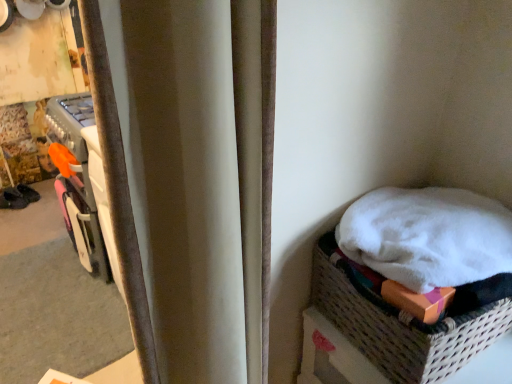
Locate an element on the screen. The width and height of the screenshot is (512, 384). dark brown leather shoe at left is located at coordinates (13, 199).

Does white woven basket at lower right lie behind velvet curtain at center?

Yes, the depth of white woven basket at lower right is greater than that of velvet curtain at center.

From a real-world perspective, between white woven basket at lower right and velvet curtain at center, who is vertically lower?

In real-world perspective, white woven basket at lower right is lower.

From the image's perspective, is white woven basket at lower right beneath velvet curtain at center?

Yes, from the image's perspective, white woven basket at lower right is beneath velvet curtain at center.

Is white woven basket at lower right situated inside velvet curtain at center or outside?

white woven basket at lower right exists outside the volume of velvet curtain at center.

Does velvet curtain at center have a larger size compared to dark brown leather shoe at left?

Correct, velvet curtain at center is larger in size than dark brown leather shoe at left.

Considering the sizes of objects velvet curtain at center and dark brown leather shoe at left in the image provided, who is taller, velvet curtain at center or dark brown leather shoe at left?

velvet curtain at center is taller.

From the image's perspective, relative to dark brown leather shoe at left, is velvet curtain at center above or below?

Based on their image positions, velvet curtain at center is located beneath dark brown leather shoe at left.

Looking at their sizes, would you say velvet curtain at center is wider or thinner than dark brown leather shoe at left?

Clearly, velvet curtain at center has more width compared to dark brown leather shoe at left.

Between dark brown leather shoe at left and white woven basket at lower right, which one has smaller size?

Smaller between the two is dark brown leather shoe at left.

Are dark brown leather shoe at left and white woven basket at lower right making contact?

No, dark brown leather shoe at left is not in contact with white woven basket at lower right.

Find the location of a particular element. footwear below the white woven basket at lower right (from a real-world perspective) is located at coordinates (13, 199).

From the image's perspective, does dark brown leather shoe at left appear higher than white woven basket at lower right?

Yes, from the image's perspective, dark brown leather shoe at left is over white woven basket at lower right.

Is velvet curtain at center bigger than white woven basket at lower right?

Correct, velvet curtain at center is larger in size than white woven basket at lower right.

Considering the relative positions of velvet curtain at center and white woven basket at lower right in the image provided, is velvet curtain at center to the left of white woven basket at lower right from the viewer's perspective?

Correct, you'll find velvet curtain at center to the left of white woven basket at lower right.

Would you say velvet curtain at center contains white woven basket at lower right?

No, velvet curtain at center does not contain white woven basket at lower right.

Which object is closer to the camera taking this photo, velvet curtain at center or white woven basket at lower right?

velvet curtain at center is in front.

Which is more to the right, white woven basket at lower right or dark brown leather shoe at left?

white woven basket at lower right is more to the right.

Can you see white woven basket at lower right touching dark brown leather shoe at left?

No, white woven basket at lower right is not next to dark brown leather shoe at left.

Is white woven basket at lower right completely or partially outside of dark brown leather shoe at left?

white woven basket at lower right lies outside dark brown leather shoe at left's area.

Consider the image. Measure the distance between white woven basket at lower right and dark brown leather shoe at left.

white woven basket at lower right is 2.86 meters from dark brown leather shoe at left.

Which object is closer to the camera taking this photo, dark brown leather shoe at left or velvet curtain at center?

velvet curtain at center is more forward.

Does dark brown leather shoe at left have a greater height compared to velvet curtain at center?

No.

Measure the distance between dark brown leather shoe at left and velvet curtain at center.

dark brown leather shoe at left and velvet curtain at center are 2.88 meters apart from each other.

Considering the sizes of objects dark brown leather shoe at left and velvet curtain at center in the image provided, who is bigger, dark brown leather shoe at left or velvet curtain at center?

Bigger between the two is velvet curtain at center.

The height and width of the screenshot is (384, 512). Find the location of `basket behind the velvet curtain at center`. basket behind the velvet curtain at center is located at coordinates (407, 319).

In the image, there is a velvet curtain at center. Where is `footwear above it (from the image's perspective)`? footwear above it (from the image's perspective) is located at coordinates (13, 199).

Looking at the image, which one is located further to velvet curtain at center, dark brown leather shoe at left or white woven basket at lower right?

dark brown leather shoe at left is further to velvet curtain at center.

When comparing their distances from dark brown leather shoe at left, does white woven basket at lower right or velvet curtain at center seem closer?

Among the two, white woven basket at lower right is located nearer to dark brown leather shoe at left.

Which object lies nearer to the anchor point white woven basket at lower right, dark brown leather shoe at left or velvet curtain at center?

velvet curtain at center.

Estimate the real-world distances between objects in this image. Which object is further from velvet curtain at center, white woven basket at lower right or dark brown leather shoe at left?

dark brown leather shoe at left.

Estimate the real-world distances between objects in this image. Which object is closer to white woven basket at lower right, velvet curtain at center or dark brown leather shoe at left?

velvet curtain at center is closer to white woven basket at lower right.

From the picture: Looking at the image, which one is located further to dark brown leather shoe at left, velvet curtain at center or white woven basket at lower right?

velvet curtain at center is positioned further to the anchor dark brown leather shoe at left.

The width and height of the screenshot is (512, 384). Identify the location of basket between velvet curtain at center and dark brown leather shoe at left in the front-back direction. (407, 319).